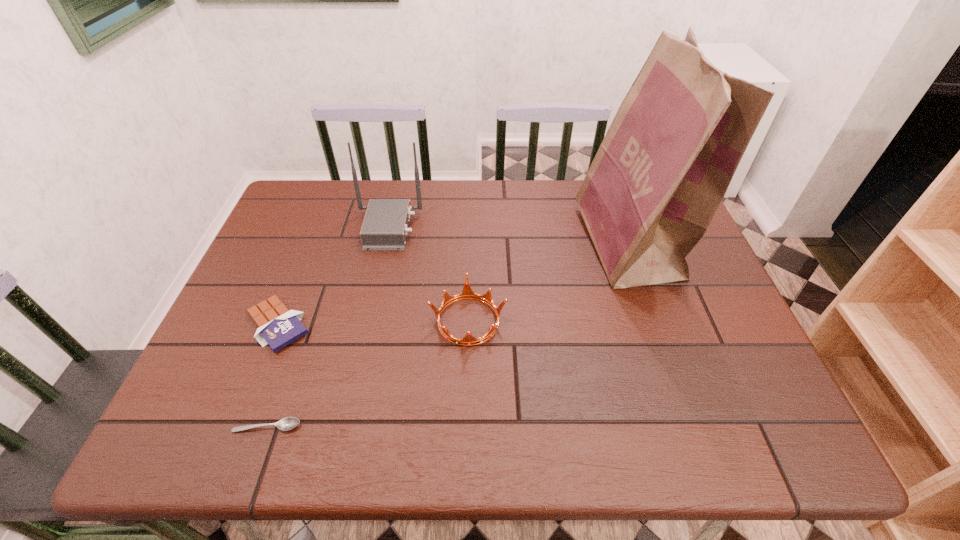
At what (x,y) coordinates should I click in order to perform the action: click on vacant space that is in between the shortest object and the crown. Please return your answer as a coordinate pair (x, y). The height and width of the screenshot is (540, 960). Looking at the image, I should click on (368, 373).

Find the location of a particular element. This screenshot has height=540, width=960. vacant area that lies between the nearest object and the fourth object from left to right is located at coordinates (368, 373).

The height and width of the screenshot is (540, 960). Identify the location of blank region between the fourth tallest object and the second tallest object. (333, 276).

This screenshot has width=960, height=540. In order to click on unoccupied position between the rightmost object and the fourth tallest object in this screenshot , I will do `click(453, 284)`.

What are the coordinates of `empty location between the fourth object from left to right and the tallest object` in the screenshot? It's located at [x=548, y=282].

This screenshot has width=960, height=540. Find the location of `empty space that is in between the crown and the chocolate bar`. empty space that is in between the crown and the chocolate bar is located at coordinates (373, 322).

Find the location of a particular element. unoccupied area between the third shortest object and the grocery bag is located at coordinates (548, 282).

Image resolution: width=960 pixels, height=540 pixels. Find the location of `free space between the tallest object and the second tallest object`. free space between the tallest object and the second tallest object is located at coordinates (508, 235).

Select which object appears as the third closest to the third tallest object. Please provide its 2D coordinates. Your answer should be formatted as a tuple, i.e. [(x, y)], where the tuple contains the x and y coordinates of a point satisfying the conditions above.

[(277, 326)]

The image size is (960, 540). In order to click on object that is the nearest to the grocery bag in this screenshot , I will do `click(467, 293)`.